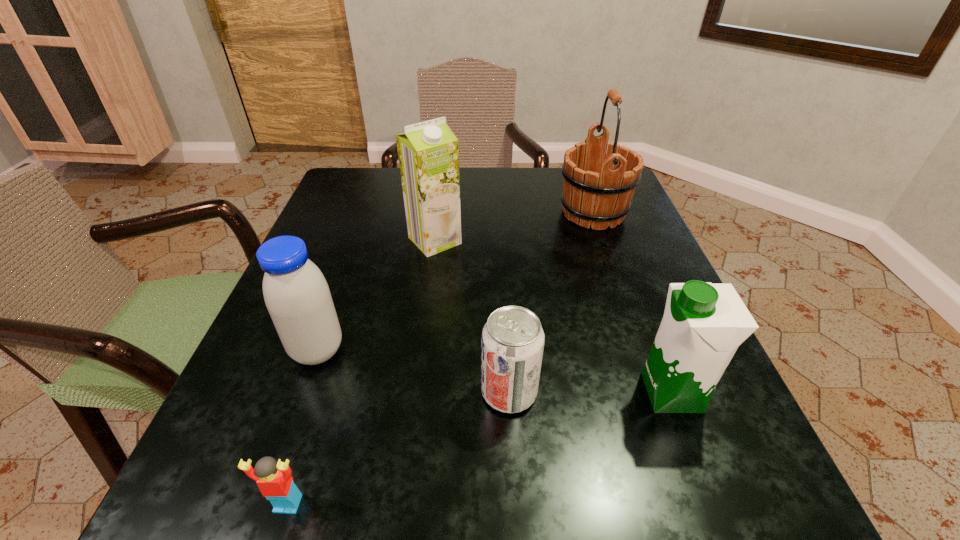
Locate an element on the screen. This screenshot has width=960, height=540. wine bucket is located at coordinates (598, 186).

This screenshot has width=960, height=540. In order to click on the second soya milk from right to left in this screenshot , I will do `click(428, 152)`.

This screenshot has width=960, height=540. What are the coordinates of `the farthest soya milk` in the screenshot? It's located at (428, 152).

Locate an element on the screen. The image size is (960, 540). the leftmost soya milk is located at coordinates (297, 296).

Where is `the rightmost soya milk`? the rightmost soya milk is located at coordinates (x=703, y=325).

Where is `soda can`? soda can is located at coordinates (512, 342).

The height and width of the screenshot is (540, 960). I want to click on the third object from right to left, so click(x=512, y=342).

At what (x,y) coordinates should I click in order to perform the action: click on the nearest object. Please return your answer as a coordinate pair (x, y). The image size is (960, 540). Looking at the image, I should click on (274, 480).

I want to click on Lego, so click(274, 480).

The image size is (960, 540). In order to click on vacant space situated 0.300m on the front of the wine bucket in this screenshot , I will do `click(639, 343)`.